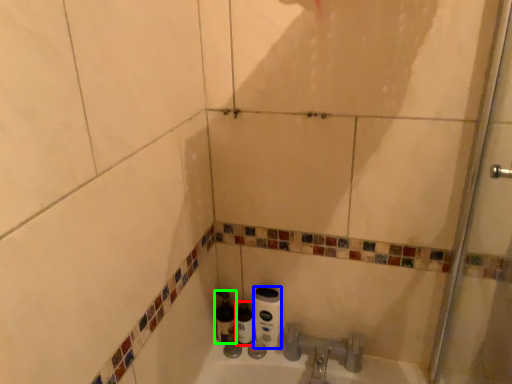
Question: Estimate the real-world distances between objects in this image. Which object is closer to bottle (highlighted by a red box), toilet paper (highlighted by a blue box) or bottle (highlighted by a green box)?

Choices:
 (A) toilet paper
 (B) bottle

Answer: (B)